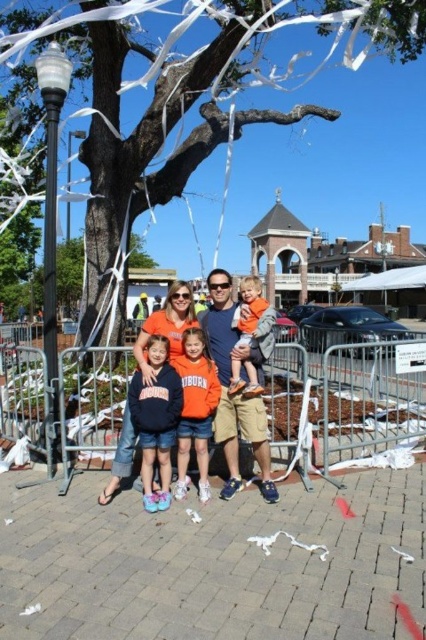
Question: Is metallic silver fence at center positioned behind orange cotton sweatshirt at center?

Choices:
 (A) yes
 (B) no

Answer: (A)

Question: Can you confirm if matte blue shirt at center is thinner than black metal pole at left?

Choices:
 (A) no
 (B) yes

Answer: (B)

Question: Which object is positioned farthest from the dark blue fleece sweatshirt at center?

Choices:
 (A) matte orange hoodie at center
 (B) orange fabric shirt at center

Answer: (A)

Question: Which object is closer to the camera taking this photo?

Choices:
 (A) orange fabric shirt at center
 (B) black metal pole at left
 (C) matte orange hoodie at center
 (D) dark blue fleece sweatshirt at center

Answer: (D)

Question: Is white glossy lamp post at left positioned before black metal pole at left?

Choices:
 (A) no
 (B) yes

Answer: (B)

Question: Based on their relative distances, which object is nearer to the matte orange hoodie at center?

Choices:
 (A) brown textured tree at upper center
 (B) dark blue fleece sweatshirt at center

Answer: (B)